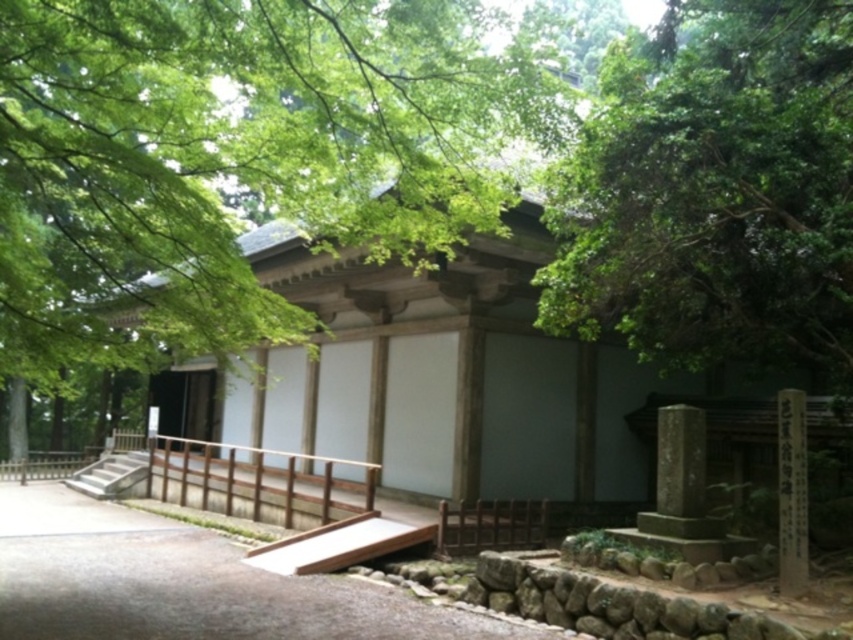
You are planning to take a photo of the temple entrance while standing at the base of the steps. The green leafy tree at center and the black stone pillar at lower right are both in your view. Which object should you avoid blocking to ensure the temple entrance remains visible in your photo?

You should avoid blocking the green leafy tree at center because its width is larger than the black stone pillar at lower right, so it might obstruct the view of the temple entrance more significantly.